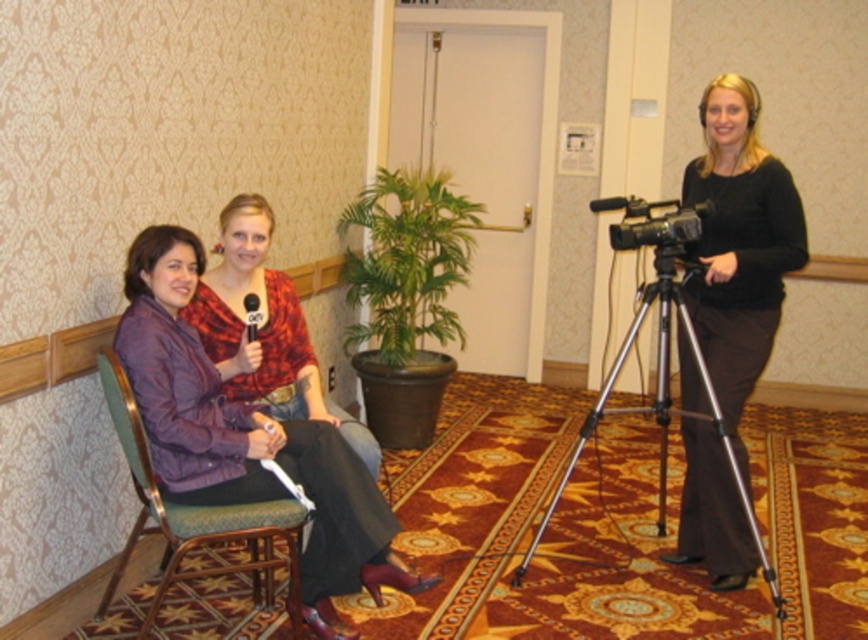
Is point (262, 209) farther from viewer compared to point (192, 516)?

Yes, point (262, 209) is farther from viewer.

Who is lower down, purple matte jacket at left or green fabric chair at left?

green fabric chair at left is lower down.

Who is more distant from viewer, [239,250] or [123,392]?

The point [239,250] is more distant.

Locate an element on the screen. purple matte jacket at left is located at coordinates (264, 330).

Who is more forward, (x=233, y=205) or (x=254, y=323)?

Point (x=254, y=323)

Who is more distant from viewer, (235,230) or (257,323)?

The point (257,323) is behind.

Between point (306, 394) and point (258, 314), which one is positioned in front?

Point (258, 314) is more forward.

Locate an element on the screen. purple matte jacket at left is located at coordinates (264, 330).

Does purple fabric jacket at left have a lesser width compared to purple matte jacket at left?

In fact, purple fabric jacket at left might be wider than purple matte jacket at left.

Does purple fabric jacket at left appear on the left side of purple matte jacket at left?

Correct, you'll find purple fabric jacket at left to the left of purple matte jacket at left.

Is point (288, 465) farther from camera compared to point (240, 381)?

No.

This screenshot has height=640, width=868. I want to click on purple fabric jacket at left, so click(245, 436).